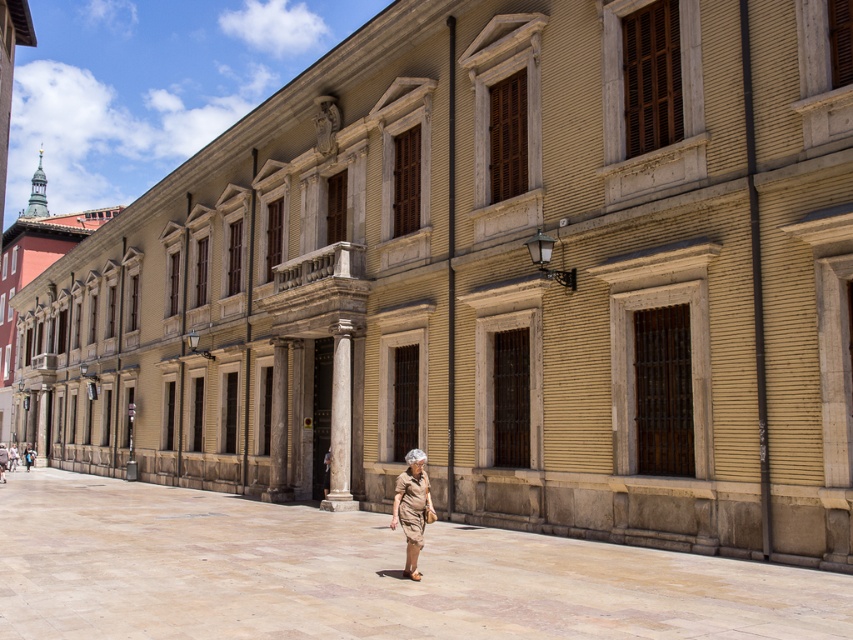
Can you confirm if brown fabric dress at center is thinner than khaki cotton shorts at center?

Indeed, brown fabric dress at center has a lesser width compared to khaki cotton shorts at center.

What do you see at coordinates (410, 508) in the screenshot? The image size is (853, 640). I see `brown fabric dress at center` at bounding box center [410, 508].

Locate an element on the screen. The width and height of the screenshot is (853, 640). brown fabric dress at center is located at coordinates (410, 508).

Is white marble column at center closer to camera compared to brown fabric dress at center?

No, it is not.

Who is positioned more to the left, white marble column at center or brown fabric dress at center?

white marble column at center

Who is more distant from viewer, (346, 497) or (405, 508)?

The point (346, 497) is behind.

Identify the location of white marble column at center. This screenshot has width=853, height=640. (340, 426).

Does brown fabric dress at center have a lesser width compared to light brown leather jacket at center?

Yes, brown fabric dress at center is thinner than light brown leather jacket at center.

Identify the location of brown fabric dress at center. This screenshot has width=853, height=640. (410, 508).